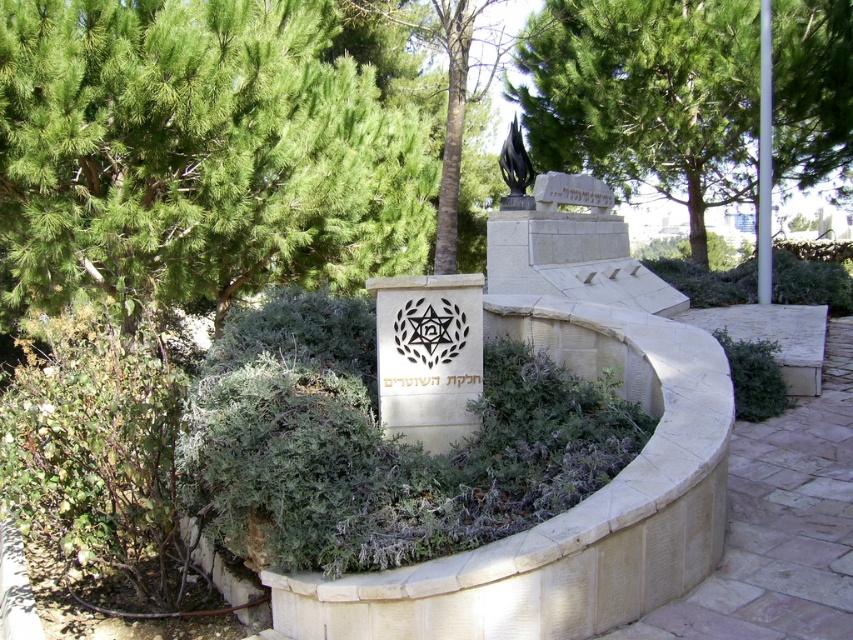
Describe the element at coordinates (200, 154) in the screenshot. This screenshot has width=853, height=640. I see `green leafy tree at upper left` at that location.

At what (x,y) coordinates should I click in order to perform the action: click on green leafy tree at upper left. Please return your answer as a coordinate pair (x, y). The image size is (853, 640). Looking at the image, I should click on (200, 154).

Can you confirm if green leafy tree at upper left is positioned above green leafy tree at center?

Yes, green leafy tree at upper left is above green leafy tree at center.

How far apart are green leafy tree at upper left and green leafy tree at center?

green leafy tree at upper left is 3.57 meters away from green leafy tree at center.

Is point (167, 120) positioned before point (402, 44)?

Yes, it is.

Find the location of `green leafy tree at upper left`. green leafy tree at upper left is located at coordinates tap(200, 154).

Which is in front, point (447, 221) or point (515, 154)?

Point (515, 154)

Is point (354, 10) less distant than point (515, 160)?

No, (354, 10) is further to viewer.

At what (x,y) coordinates should I click in order to perform the action: click on green leafy tree at center. Please return your answer as a coordinate pair (x, y). This screenshot has width=853, height=640. Looking at the image, I should click on (430, 92).